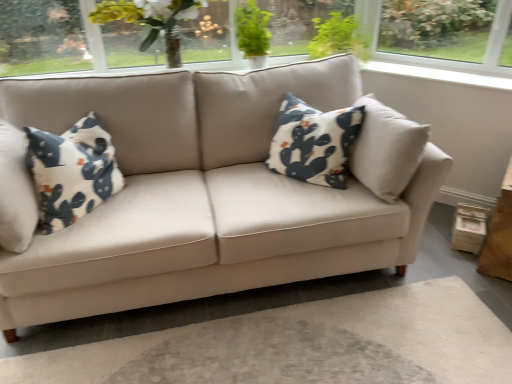
Question: From the image's perspective, is translucent glass vase at upper center located above or below green leafy plant at upper center?

Choices:
 (A) above
 (B) below

Answer: (B)

Question: In terms of height, does translucent glass vase at upper center look taller or shorter compared to green leafy plant at upper center?

Choices:
 (A) short
 (B) tall

Answer: (B)

Question: Estimate the real-world distances between objects in this image. Which object is farther from the translucent glass vase at upper center?

Choices:
 (A) green leafy plant at upper center
 (B) wooden table at lower right

Answer: (B)

Question: Which is farther from the wooden table at lower right?

Choices:
 (A) green leafy plant at upper center
 (B) translucent glass vase at upper center

Answer: (B)